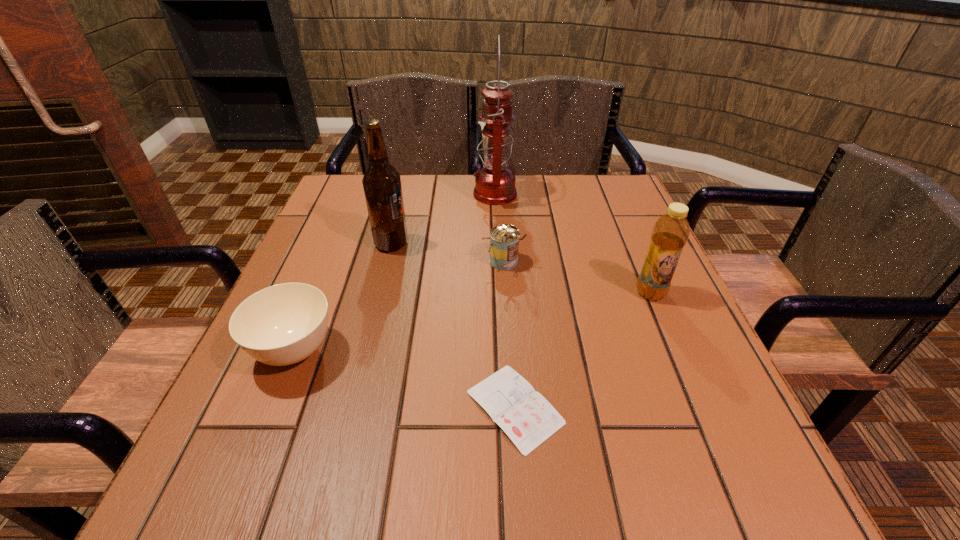
Where is `vacant space situated 0.180m on the left of the tallest object`? vacant space situated 0.180m on the left of the tallest object is located at coordinates (408, 193).

The width and height of the screenshot is (960, 540). What are the coordinates of `free space located 0.060m on the label of the second tallest object` in the screenshot? It's located at (433, 244).

Identify the location of free region located 0.330m on the back of the bottle. (612, 201).

Identify the location of vacant space situated on the right of the third shortest object. (612, 262).

Where is `vacant space located on the right of the leftmost object`? The height and width of the screenshot is (540, 960). vacant space located on the right of the leftmost object is located at coordinates coord(548,351).

Locate an element on the screen. This screenshot has height=540, width=960. vacant space located on the left of the shortest object is located at coordinates (281, 407).

Find the location of a particular element. The height and width of the screenshot is (540, 960). object situated at the far edge is located at coordinates (495, 183).

Find the location of `object that is positioned at the near edge`. object that is positioned at the near edge is located at coordinates (526, 417).

You are a GUI agent. You are given a task and a screenshot of the screen. Output one action in this format:
    pyautogui.click(x=<x>, y=<y>)
    Task: Click on the object that is at the left edge
    
    Given the screenshot: What is the action you would take?
    pyautogui.click(x=283, y=324)

This screenshot has width=960, height=540. In order to click on object located at the right edge in this screenshot , I will do `click(670, 233)`.